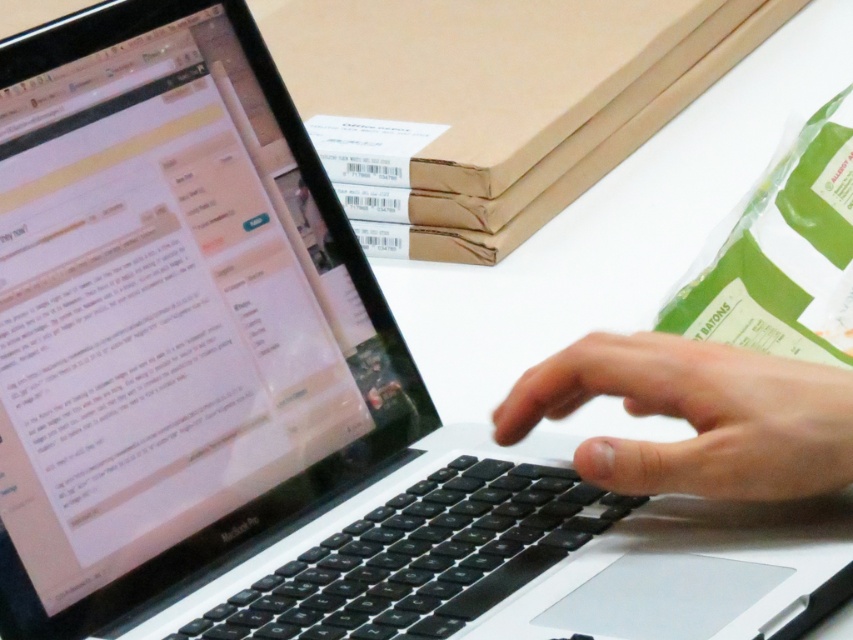
You are organizing items on a desk and need to place a new object between the two points labeled point (173, 518) and point (519, 401). Based on their positions, which point should be closer to the front edge of the desk?

Point (519, 401) is closer to the front edge of the desk because it is in front of point (173, 518).

You need to place a 10cm wide object between the black matte laptop at left and the black matte hand at center. Based on their widths, can you determine if there is enough space?

The black matte laptop at left might be wider than black matte hand at center, so the total width required for both objects would depend on their individual widths. However, since the laptop might be wider, there could be sufficient space if the combined width of both objects is less than the available space between them. Without exact measurements, it is uncertain if the 10cm wide object will fit.

In the scene shown: You are trying to place a small USB drive between the black matte laptop at left and the black matte hand at center on the desk. Considering their sizes, will the USB drive fit in the space between them?

The black matte laptop at left is larger than the black matte hand at center. Since the laptop is bigger, there might be sufficient space between them to place the USB drive, but the exact fit depends on the USB drive size and the gap available.